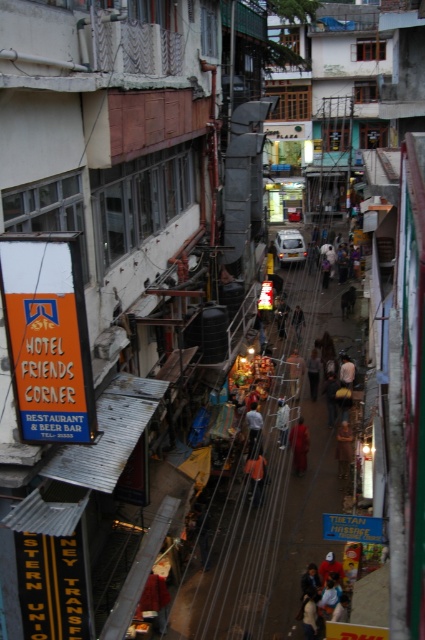
Question: Does matte black jacket at center come behind dark blue shirt at center?

Choices:
 (A) no
 (B) yes

Answer: (B)

Question: Where is dark brown leather jacket at center located in relation to orange fabric bag at center in the image?

Choices:
 (A) above
 (B) below

Answer: (B)

Question: Considering the real-world distances, which object is farthest from the dark brown leather jacket at center?

Choices:
 (A) orange fabric bag at center
 (B) matte black jacket at center
 (C) orange fabric person at center
 (D) dark blue shirt at center

Answer: (B)

Question: Is dark blue jacket at lower center smaller than orange fabric person at center?

Choices:
 (A) no
 (B) yes

Answer: (A)

Question: Which point is farther to the camera?

Choices:
 (A) (246, 468)
 (B) (295, 371)
 (C) (346, 432)
 (D) (282, 449)

Answer: (B)

Question: Which of the following is the closest to the observer?

Choices:
 (A) orange fabric bag at center
 (B) dark brown leather jacket at center

Answer: (B)